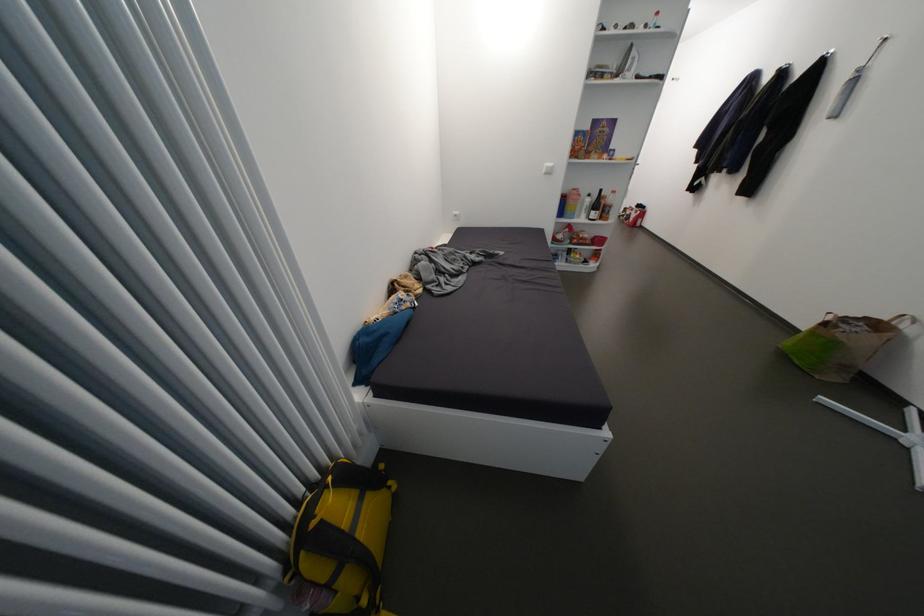
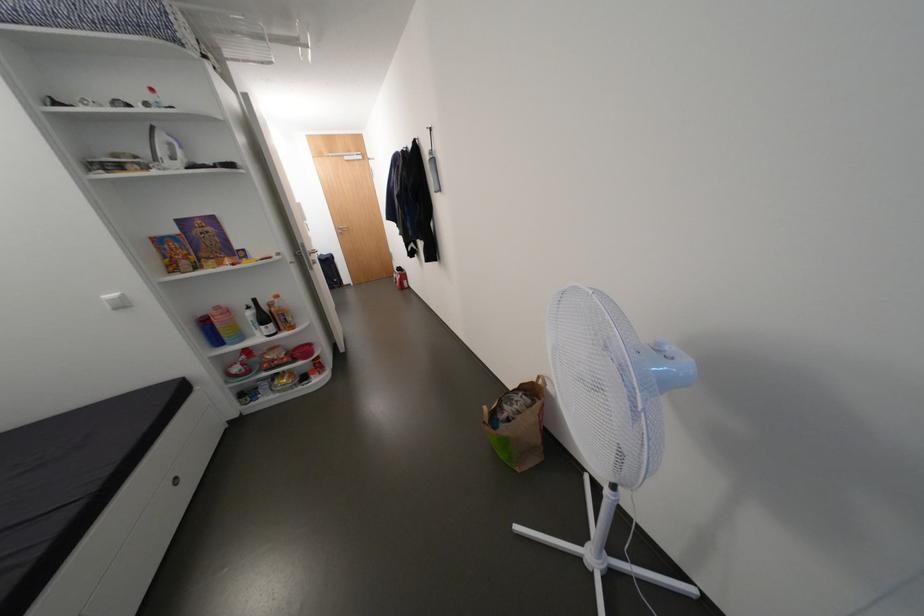
Where in the second image is the point corresponding to pixel 596 201 from the first image?

(258, 315)